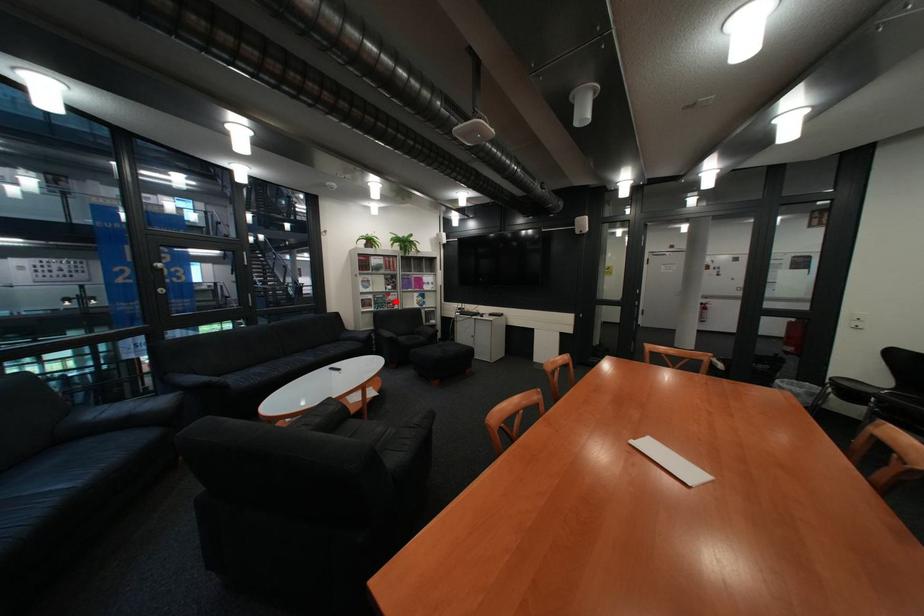
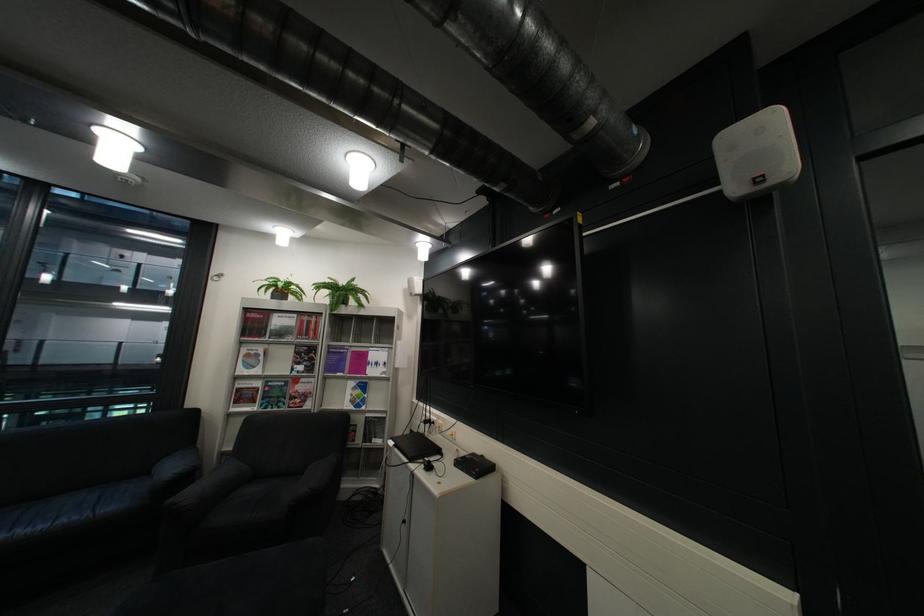
Where in the second image is the point corresponding to the highlighted location from the first image?

(290, 394)